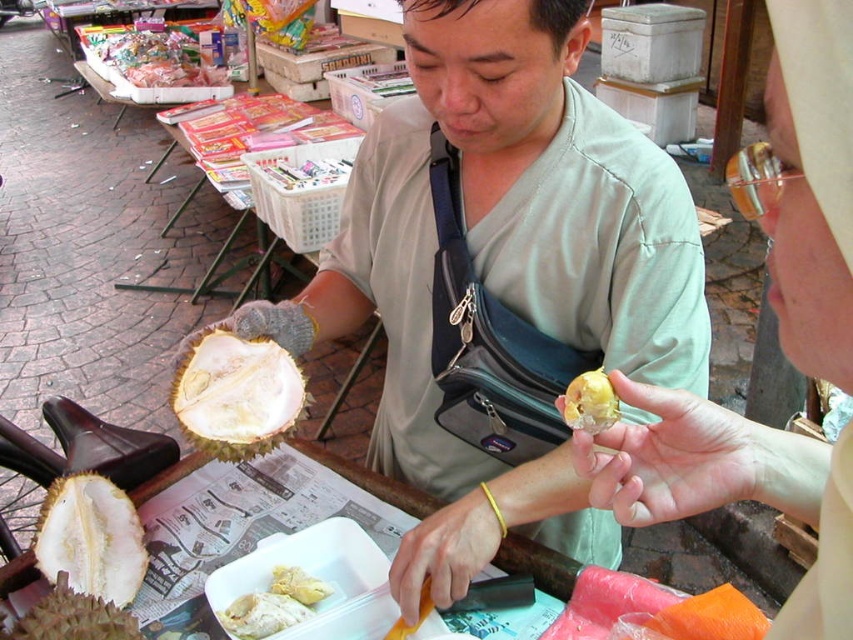
Which is more to the right, smooth golden durian at center or white matte durian at center?

smooth golden durian at center

Does smooth golden durian at center lie in front of white matte durian at center?

That is True.

What do you see at coordinates (730, 486) in the screenshot? I see `smooth golden durian at center` at bounding box center [730, 486].

Identify the location of smooth golden durian at center. (x=730, y=486).

Is the position of spike-covered durian at center less distant than that of yellow matte durian at center?

No.

This screenshot has height=640, width=853. What do you see at coordinates (70, 618) in the screenshot?
I see `spike-covered durian at center` at bounding box center [70, 618].

Locate an element on the screen. spike-covered durian at center is located at coordinates (70, 618).

Who is positioned more to the left, white textured durian at center or yellow matte durian at center?

white textured durian at center is more to the left.

Is white textured durian at center further to camera compared to yellow matte durian at center?

Yes.

Measure the distance between point (270, 426) and camera.

They are 32.90 inches apart.

Locate an element on the screen. The image size is (853, 640). white textured durian at center is located at coordinates (236, 394).